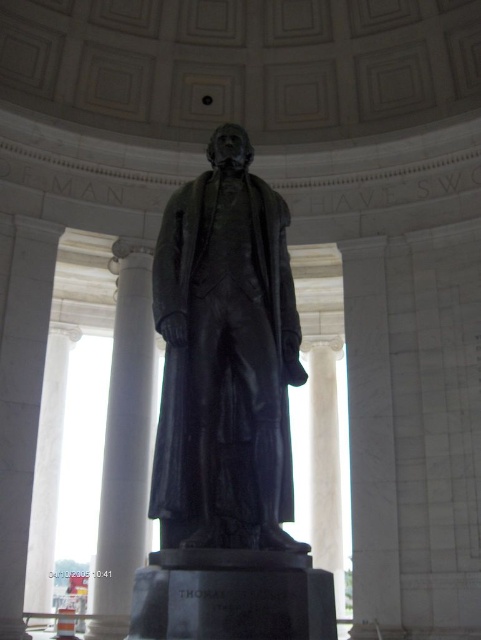
You are visiting the Jefferson Memorial and want to take a photo of the black polished statue at center and the white marble column at center. Which object should you focus on first if you want to capture both in a single frame without moving the camera?

The black polished statue at center is smaller than the white marble column at center, so you should focus on the white marble column at center first to ensure it fits within the frame, then adjust the camera to include the statue.

You are standing inside the Jefferson Memorial and want to take a photo of the black polished statue at center. However, there is a white marble column at center in the way. Can you see the statue behind the column?

The black polished statue at center is closer to the viewer than the white marble column at center, so the statue is in front of the column and would block the view of the statue behind it. Therefore, you cannot see the statue behind the column.